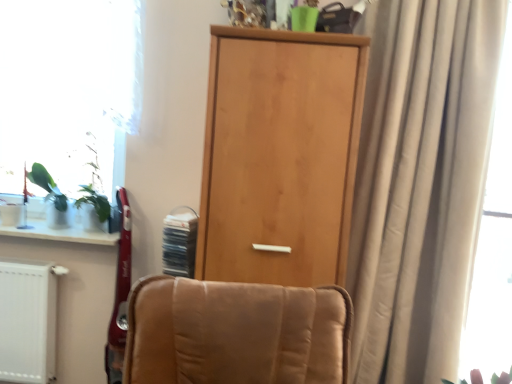
Question: Based on their sizes in the image, would you say beige fabric curtain at right is bigger or smaller than translucent fabric curtain at right?

Choices:
 (A) small
 (B) big

Answer: (B)

Question: Is beige fabric curtain at right wider or thinner than translucent fabric curtain at right?

Choices:
 (A) wide
 (B) thin

Answer: (A)

Question: Estimate the real-world distances between objects in this image. Which object is farther from the beige fabric curtain at right?

Choices:
 (A) translucent fabric curtain at right
 (B) transparent glass window at left
 (C) light wood door at center
 (D) white glossy window sill at lower left

Answer: (D)

Question: Based on their relative distances, which object is farther from the translucent fabric curtain at right?

Choices:
 (A) light wood door at center
 (B) transparent glass window at left
 (C) white glossy window sill at lower left
 (D) beige fabric curtain at right

Answer: (C)